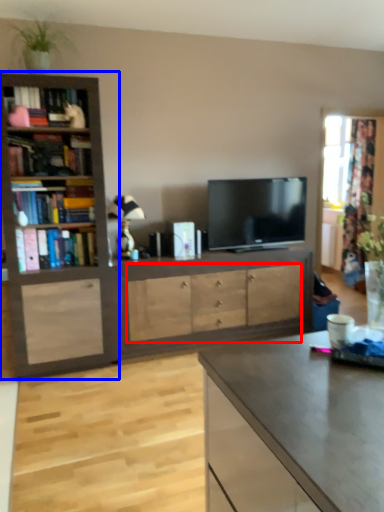
Question: Which object is further to the camera taking this photo, drawer (highlighted by a red box) or bookcase (highlighted by a blue box)?

Choices:
 (A) drawer
 (B) bookcase

Answer: (A)